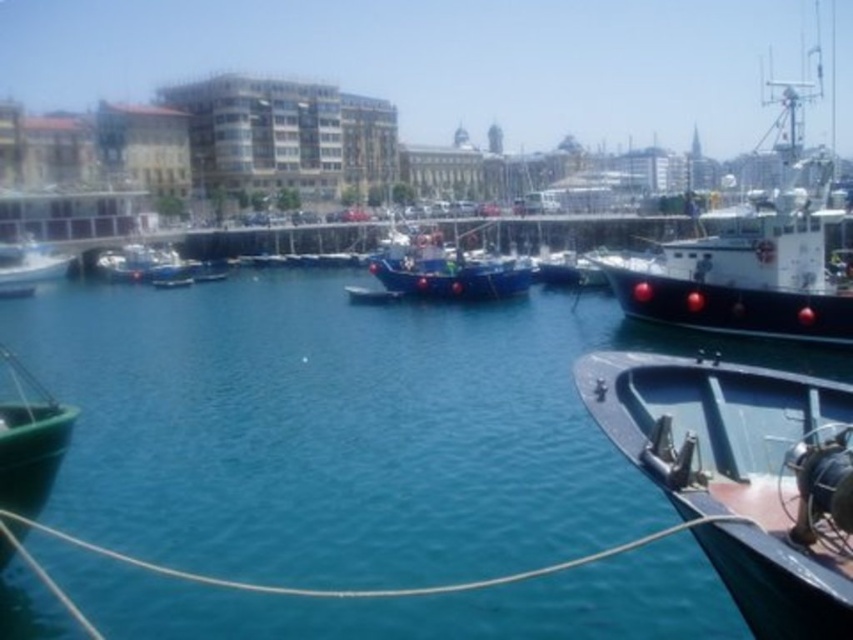
Which of these two, white matte boat at right or white glossy boat at left, stands taller?

With more height is white matte boat at right.

Who is positioned more to the right, white matte boat at right or white glossy boat at left?

From the viewer's perspective, white matte boat at right appears more on the right side.

Is point (648, 266) positioned before point (9, 275)?

Yes.

This screenshot has width=853, height=640. In order to click on white matte boat at right in this screenshot , I will do `click(752, 256)`.

At what (x,y) coordinates should I click in order to perform the action: click on white matte boat at right. Please return your answer as a coordinate pair (x, y). Image resolution: width=853 pixels, height=640 pixels. Looking at the image, I should click on (752, 256).

In the scene shown: Who is more forward, [733,230] or [349,292]?

Point [733,230] is more forward.

Find the location of a particular element. Image resolution: width=853 pixels, height=640 pixels. white matte boat at right is located at coordinates (752, 256).

Is blue matte boat at left to the left of metallic blue boat at center from the viewer's perspective?

Correct, you'll find blue matte boat at left to the left of metallic blue boat at center.

Does blue matte boat at left have a smaller size compared to metallic blue boat at center?

Actually, blue matte boat at left might be larger than metallic blue boat at center.

Is point (97, 260) closer to viewer compared to point (378, 294)?

No, it is behind (378, 294).

This screenshot has width=853, height=640. Identify the location of blue matte boat at left. (144, 262).